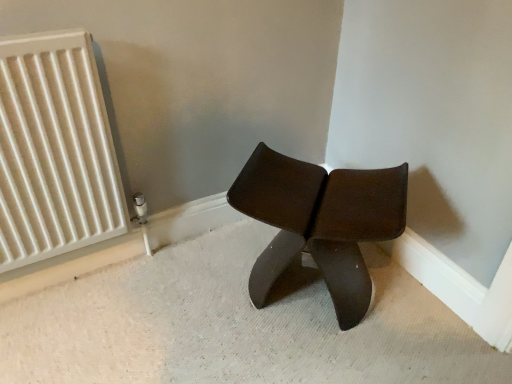
What is the approximate height of matte brown stool at center?

It is 16.50 inches.

This screenshot has width=512, height=384. What do you see at coordinates (320, 222) in the screenshot?
I see `matte brown stool at center` at bounding box center [320, 222].

The image size is (512, 384). Find the location of `matte brown stool at center`. matte brown stool at center is located at coordinates [320, 222].

This screenshot has height=384, width=512. Identify the location of white matte radiator at left. (54, 151).

What do you see at coordinates (54, 151) in the screenshot?
I see `white matte radiator at left` at bounding box center [54, 151].

The image size is (512, 384). Find the location of `matte brown stool at center`. matte brown stool at center is located at coordinates (320, 222).

Can you confirm if matte brown stool at center is positioned to the left of white matte radiator at left?

No, matte brown stool at center is not to the left of white matte radiator at left.

Considering their positions, is matte brown stool at center located in front of or behind white matte radiator at left?

In the image, matte brown stool at center appears behind white matte radiator at left.

Does point (362, 193) come farther from viewer compared to point (13, 44)?

Yes, point (362, 193) is farther from viewer.

From the image's perspective, which is above, matte brown stool at center or white matte radiator at left?

white matte radiator at left, from the image's perspective.

From a real-world perspective, is matte brown stool at center beneath white matte radiator at left?

Indeed, from a real-world perspective, matte brown stool at center is positioned beneath white matte radiator at left.

Does matte brown stool at center have a lesser width compared to white matte radiator at left?

Incorrect, the width of matte brown stool at center is not less than that of white matte radiator at left.

Considering the sizes of objects matte brown stool at center and white matte radiator at left in the image provided, who is shorter, matte brown stool at center or white matte radiator at left?

matte brown stool at center is shorter.

Considering the sizes of objects matte brown stool at center and white matte radiator at left in the image provided, who is smaller, matte brown stool at center or white matte radiator at left?

white matte radiator at left.

Do you think matte brown stool at center is within white matte radiator at left, or outside of it?

matte brown stool at center lies outside white matte radiator at left.

Are matte brown stool at center and white matte radiator at left making contact?

There is a gap between matte brown stool at center and white matte radiator at left.

Is matte brown stool at center facing away from white matte radiator at left?

That's not correct — matte brown stool at center is not looking away from white matte radiator at left.

Identify the location of radiator on the left of the matte brown stool at center. The height and width of the screenshot is (384, 512). (54, 151).

Is white matte radiator at left at the left side of matte brown stool at center?

Correct, you'll find white matte radiator at left to the left of matte brown stool at center.

Is the position of white matte radiator at left less distant than that of matte brown stool at center?

Yes, the depth of white matte radiator at left is less than that of matte brown stool at center.

Is point (41, 142) closer or farther from the camera than point (279, 186)?

Point (41, 142) is closer to the camera than point (279, 186).

From the image's perspective, which object appears higher, white matte radiator at left or matte brown stool at center?

white matte radiator at left, from the image's perspective.

In the scene shown: From a real-world perspective, is white matte radiator at left positioned above or below matte brown stool at center?

From a real-world perspective, white matte radiator at left is physically above matte brown stool at center.

Can you confirm if white matte radiator at left is wider than matte brown stool at center?

Incorrect, the width of white matte radiator at left does not surpass that of matte brown stool at center.

Is white matte radiator at left taller or shorter than matte brown stool at center?

In the image, white matte radiator at left appears to be taller than matte brown stool at center.

Is white matte radiator at left smaller than matte brown stool at center?

Yes, white matte radiator at left is smaller than matte brown stool at center.

Is white matte radiator at left inside or outside of matte brown stool at center?

white matte radiator at left is not enclosed by matte brown stool at center.

Is white matte radiator at left far from matte brown stool at center?

They are positioned close to each other.

Is white matte radiator at left turned away from matte brown stool at center?

white matte radiator at left is not turned away from matte brown stool at center.

How many degrees apart are the facing directions of white matte radiator at left and matte brown stool at center?

There is a 47-degree angle between the facing directions of white matte radiator at left and matte brown stool at center.

Find the location of a particular element. chair below the white matte radiator at left (from the image's perspective) is located at coordinates (320, 222).

This screenshot has height=384, width=512. I want to click on chair on the right of white matte radiator at left, so click(x=320, y=222).

Locate an element on the screen. radiator above the matte brown stool at center (from the image's perspective) is located at coordinates (54, 151).